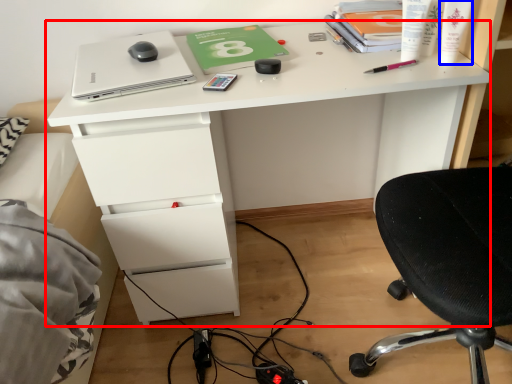
Question: Among these objects, which one is farthest to the camera, desk (highlighted by a red box) or toiletry (highlighted by a blue box)?

Choices:
 (A) desk
 (B) toiletry

Answer: (A)